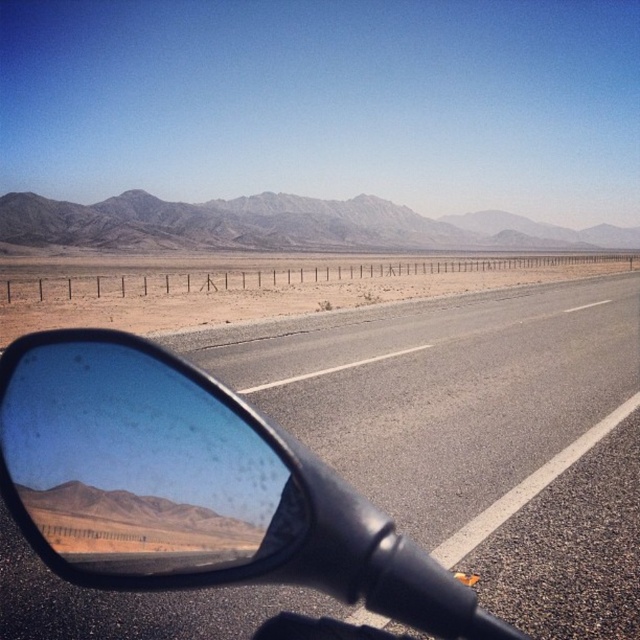
You are riding a motorcycle and looking at the road ahead. You see the asphalt road at center and the gray rocky mountain at upper center. Which object is positioned to the left when viewed from your perspective?

The asphalt road at center is to the left of gray rocky mountain at upper center, so the asphalt road at center is positioned to the left.

Consider the image. You are riding a motorcycle and looking at the glossy black mirror at lower left. Can you see the asphalt road at center in the mirror?

The glossy black mirror at lower left is behind the asphalt road at center, so you cannot see the asphalt road at center in the mirror because it is in front of the mirror.